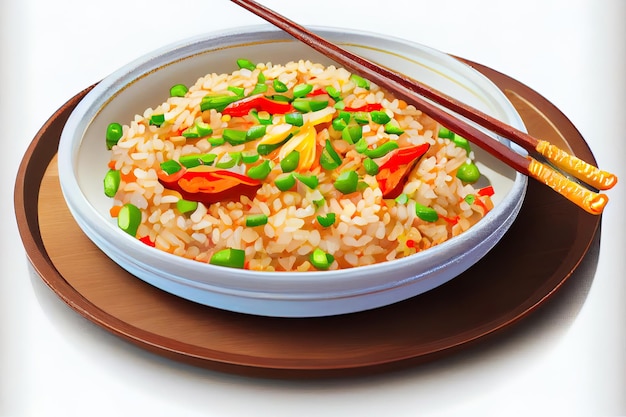
At what (x,y) coordinates should I click in order to perform the action: click on brown plate. Please return your answer as a coordinate pair (x, y). Looking at the image, I should click on (381, 336).